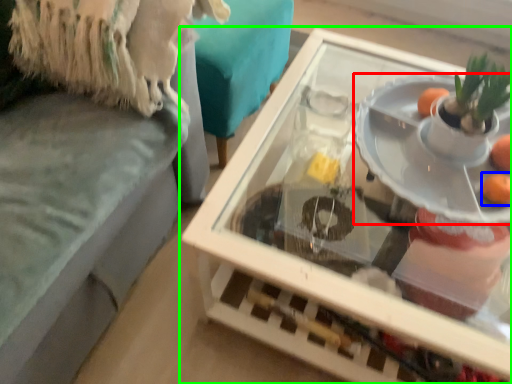
Question: Which is nearer to the plate (highlighted by a red box)? orange (highlighted by a blue box) or table (highlighted by a green box).

Choices:
 (A) orange
 (B) table

Answer: (A)